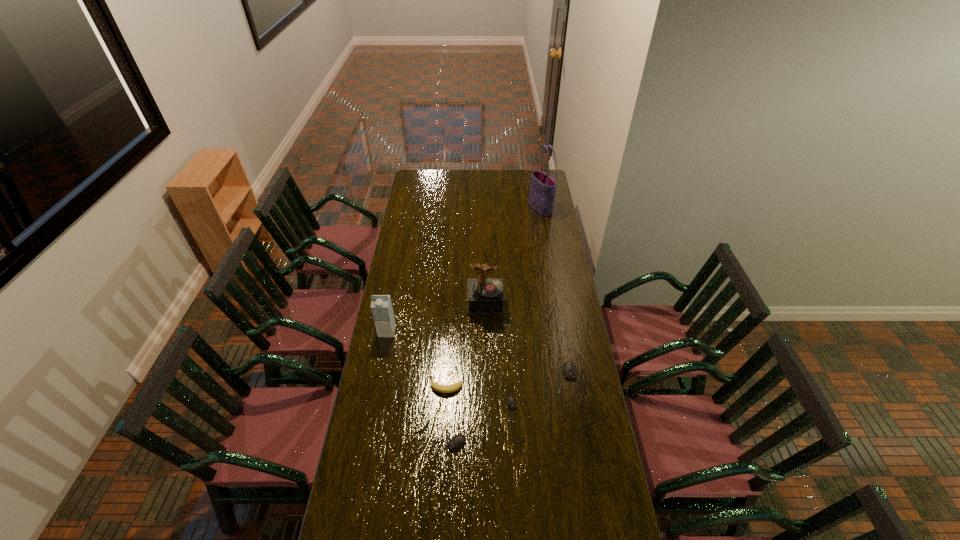
Find the location of `object present at the left edge`. object present at the left edge is located at coordinates (381, 306).

I want to click on mouse that is at the right edge, so click(569, 371).

Locate an element on the screen. tote bag at the right edge is located at coordinates (543, 187).

What are the coordinates of `vacant area at the far edge` in the screenshot? It's located at (458, 172).

Where is `vacant space at the near edge of the desktop`? vacant space at the near edge of the desktop is located at coordinates (509, 536).

At what (x,y) coordinates should I click in order to perform the action: click on vacant region at the left edge of the desktop. Please return your answer as a coordinate pair (x, y). This screenshot has width=960, height=540. Looking at the image, I should click on (414, 214).

The image size is (960, 540). In order to click on free space at the right edge in this screenshot , I will do `click(563, 301)`.

In the image, there is a desktop. At what (x,y) coordinates should I click in order to perform the action: click on free space at the near left corner. Please return your answer as a coordinate pair (x, y). The width and height of the screenshot is (960, 540). Looking at the image, I should click on (378, 507).

At what (x,y) coordinates should I click in order to perform the action: click on vacant space that is in between the farthest mouse and the leftmost mouse. Please return your answer as a coordinate pair (x, y). Looking at the image, I should click on (507, 411).

The width and height of the screenshot is (960, 540). In order to click on free space between the banana and the fifth nearest object in this screenshot , I will do `click(417, 359)`.